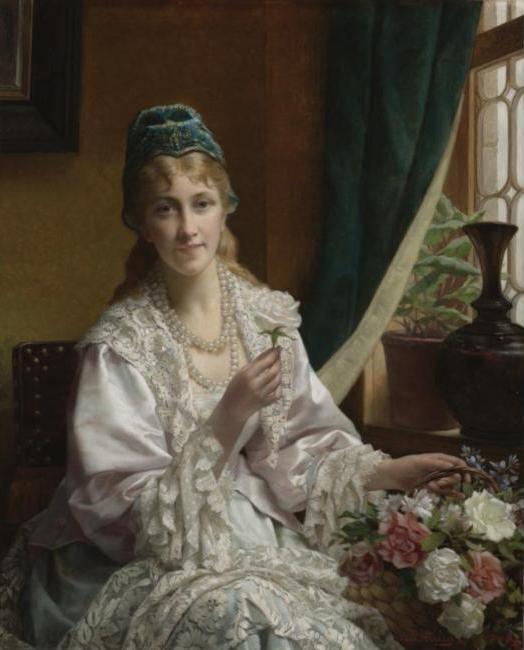
What are the coordinates of `vase` in the screenshot? It's located at (409, 382), (468, 378).